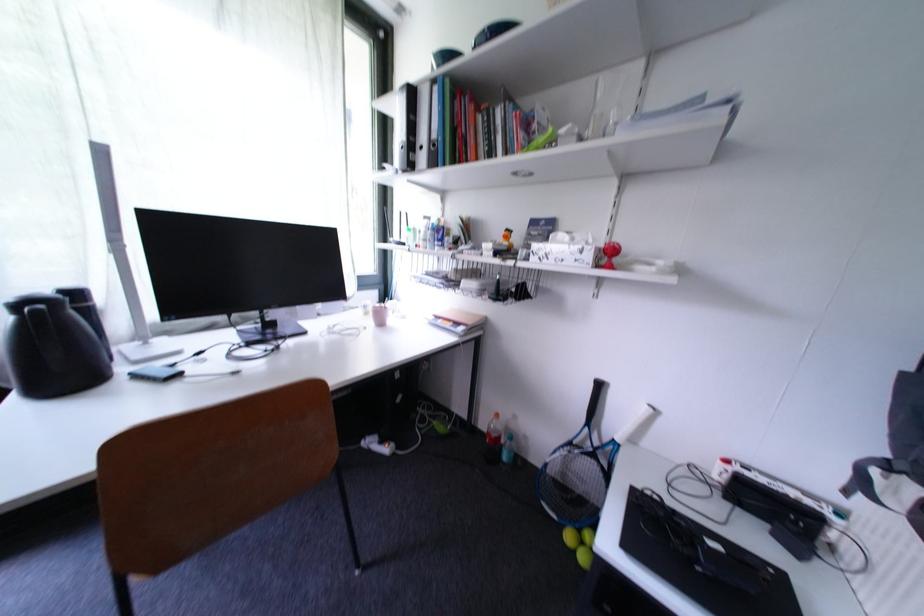
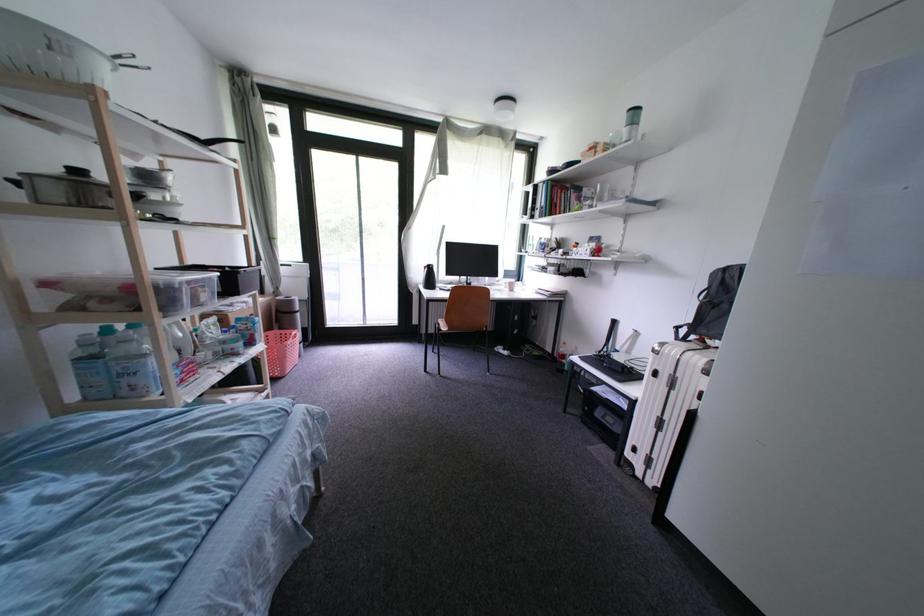
Where in the second image is the point corresponding to the point at 43,313 from the first image?

(439, 270)